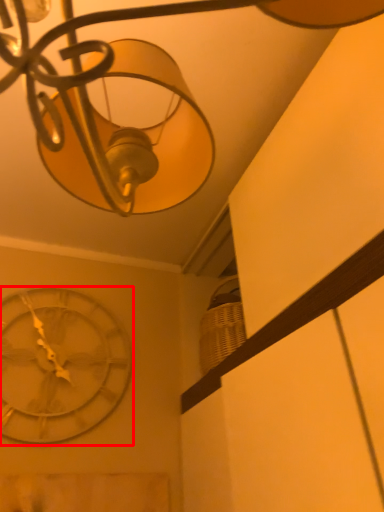
Question: Observing the image, what is the correct spatial positioning of wall clock (annotated by the red box) in reference to lamp?

Choices:
 (A) right
 (B) left

Answer: (B)